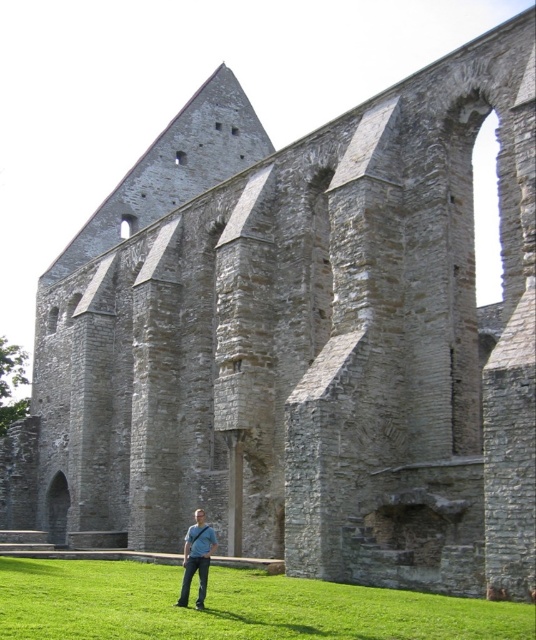
You are standing in front of the ruins of an old stone building. You notice green grass at lower center and blue denim jeans at lower center. Which object is located to the left of the other?

The green grass at lower center is positioned on the left side of blue denim jeans at lower center.